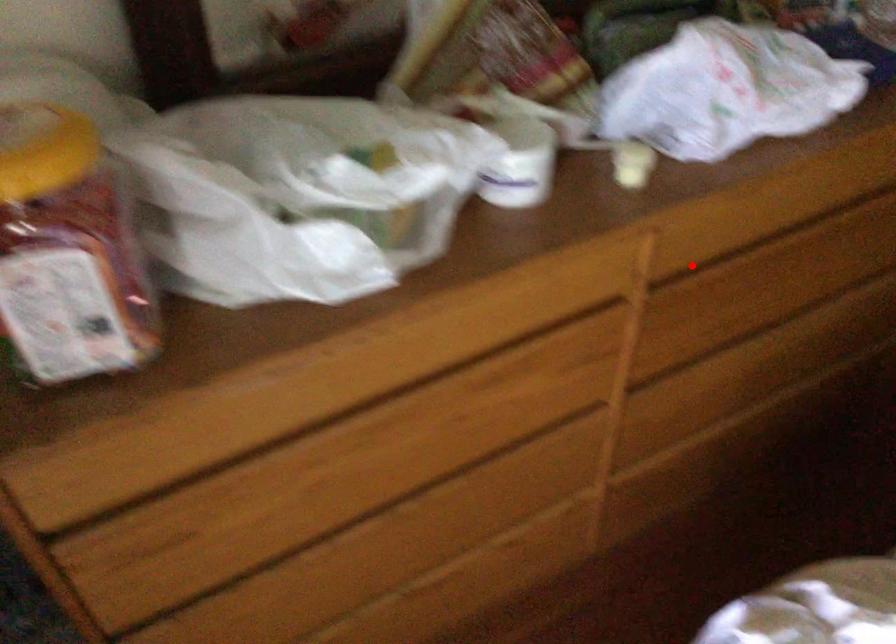
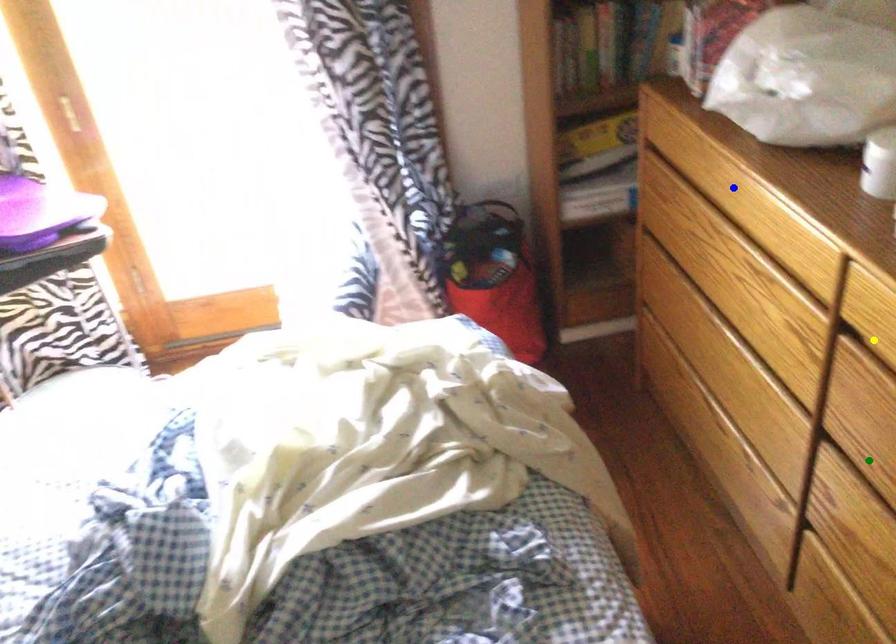
Question: I am providing you with two images of the same scene from different viewpoints. A red point is marked on the first image. You are given multiple points on the second image. Can you choose the point in image 2 that corresponds to the point in image 1?

Choices:
 (A) green point
 (B) yellow point
 (C) blue point

Answer: (B)